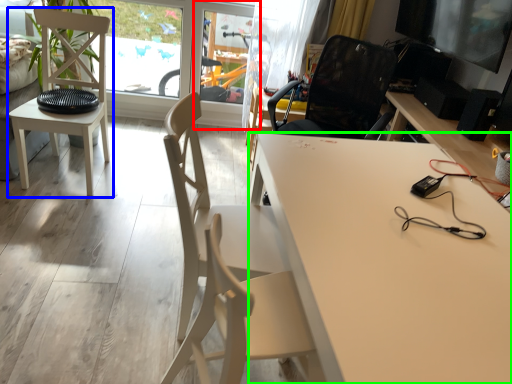
Question: Based on their relative distances, which object is farther from screen door (highlighted by a red box)? Choose from chair (highlighted by a blue box) and desk (highlighted by a green box).

Choices:
 (A) chair
 (B) desk

Answer: (B)